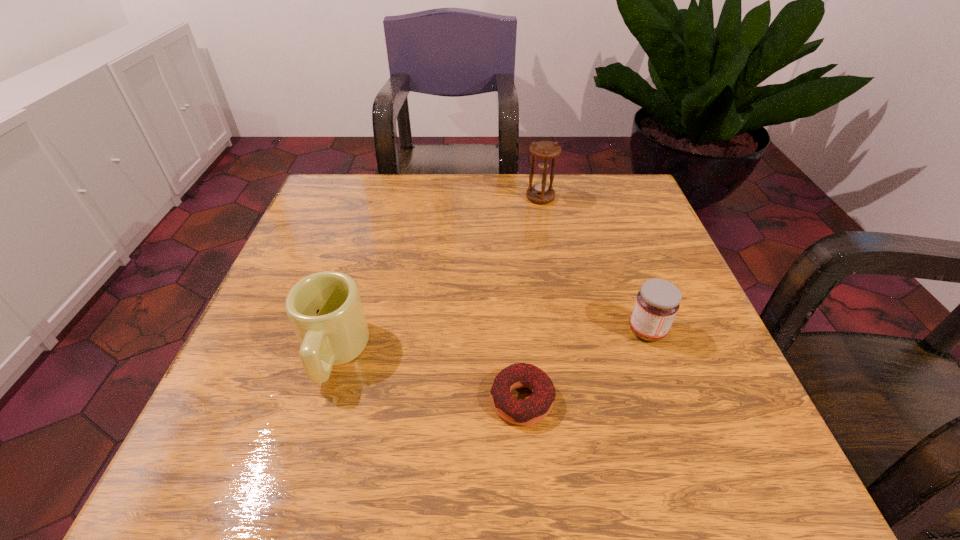
Locate an element on the screen. free space at the far right corner is located at coordinates (632, 186).

Locate an element on the screen. vacant region at the near right corner of the desktop is located at coordinates (755, 483).

Identify the location of empty location between the shortest object and the second object from right to left. Image resolution: width=960 pixels, height=540 pixels. (531, 299).

Find the location of a particular element. This screenshot has width=960, height=540. vacant region between the jam and the mug is located at coordinates (491, 341).

Locate an element on the screen. The image size is (960, 540). vacant area that lies between the mug and the shortest object is located at coordinates (427, 376).

You are a GUI agent. You are given a task and a screenshot of the screen. Output one action in this format:
    pyautogui.click(x=<x>, y=<y>)
    Task: Click on the free space between the leftmost object and the second object from left to right
    The image size is (960, 540).
    Given the screenshot: What is the action you would take?
    pyautogui.click(x=427, y=376)

Locate an element on the screen. vacant space that is in between the second tallest object and the rightmost object is located at coordinates tap(491, 341).

Identify the location of unoccupied area between the third tallest object and the mug. The height and width of the screenshot is (540, 960). (491, 341).

Locate an element on the screen. vacant area that lies between the mug and the shortest object is located at coordinates (427, 376).

Identify the location of free area in between the third shortest object and the second object from left to right. (427, 376).